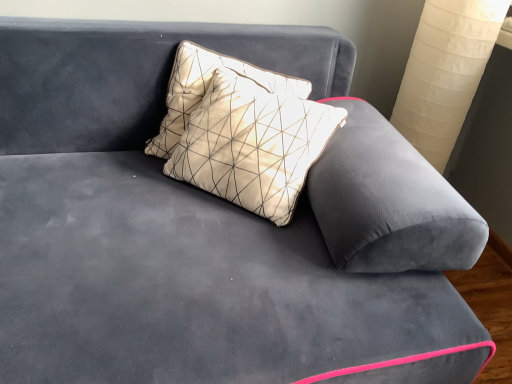
This screenshot has height=384, width=512. Describe the element at coordinates (206, 90) in the screenshot. I see `white matte pillow at upper center` at that location.

The height and width of the screenshot is (384, 512). I want to click on white matte pillow at upper center, so click(206, 90).

You are a GUI agent. You are given a task and a screenshot of the screen. Output one action in this format:
    pyautogui.click(x=<x>, y=<y>)
    Task: Click on the white matte pillow at upper center
    The height and width of the screenshot is (384, 512).
    Given the screenshot: What is the action you would take?
    pyautogui.click(x=206, y=90)